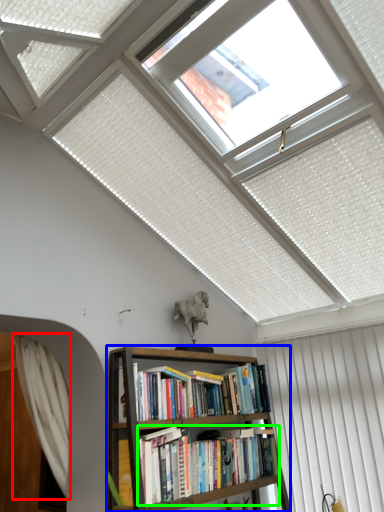
Question: Based on their relative distances, which object is farther from curtain (highlighted by a red box)? Choose from bookcase (highlighted by a blue box) and book (highlighted by a green box).

Choices:
 (A) bookcase
 (B) book

Answer: (B)